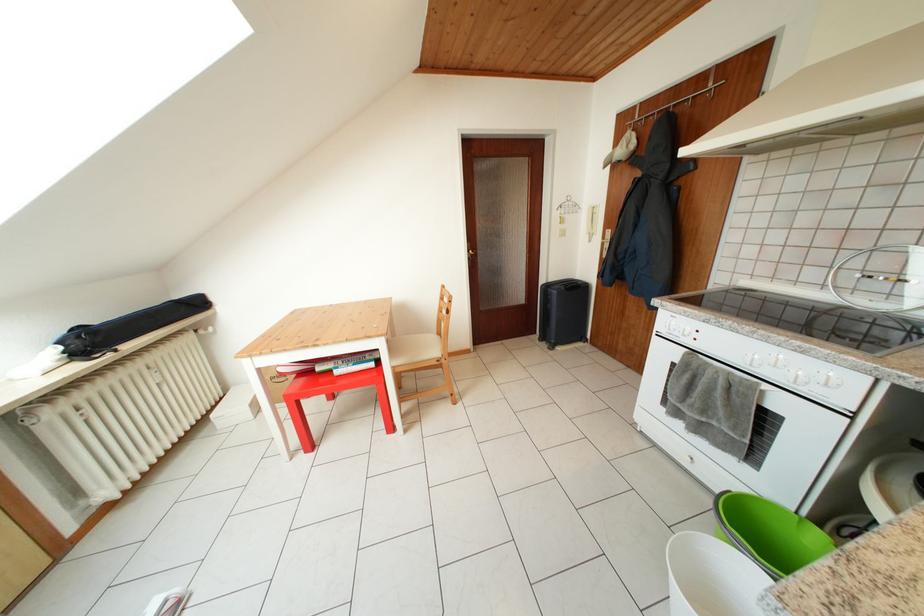
Image resolution: width=924 pixels, height=616 pixels. Find the location of `white wall switch`. white wall switch is located at coordinates (591, 222).